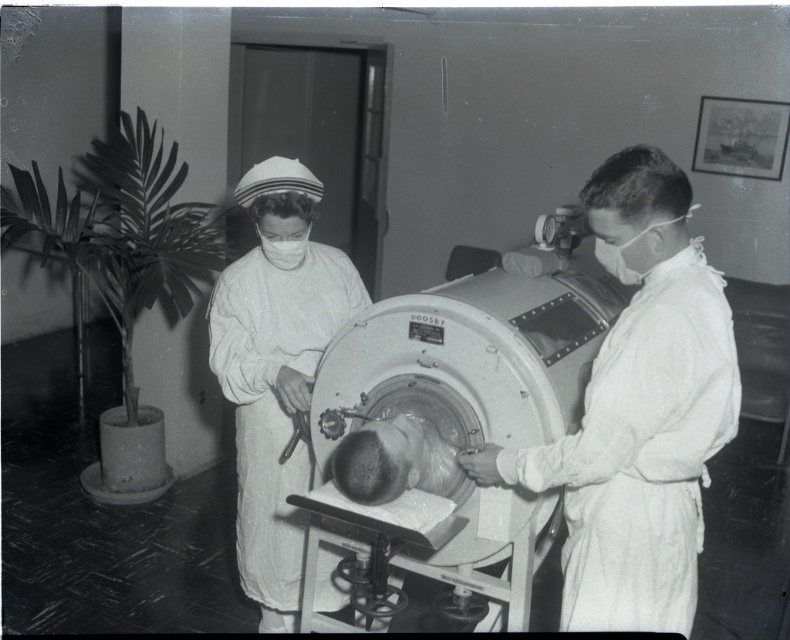
Who is positioned more to the left, metallic cylindrical tank at center or matte white mask at center?

matte white mask at center is more to the left.

The width and height of the screenshot is (790, 640). What do you see at coordinates (474, 349) in the screenshot?
I see `metallic cylindrical tank at center` at bounding box center [474, 349].

You are a GUI agent. You are given a task and a screenshot of the screen. Output one action in this format:
    pyautogui.click(x=<x>, y=<y>)
    Task: Click on the metallic cylindrical tank at center
    
    Given the screenshot: What is the action you would take?
    pyautogui.click(x=474, y=349)

Based on the photo, between smooth white coat at center and white cloth nurse at center, which one has less height?

With less height is smooth white coat at center.

Looking at this image, is smooth white coat at center shorter than white cloth nurse at center?

Yes.

Locate an element on the screen. This screenshot has width=790, height=640. smooth white coat at center is located at coordinates (638, 412).

Who is positioned more to the left, smooth white coat at center or matte white mask at center?

matte white mask at center

Locate an element on the screen. smooth white coat at center is located at coordinates (638, 412).